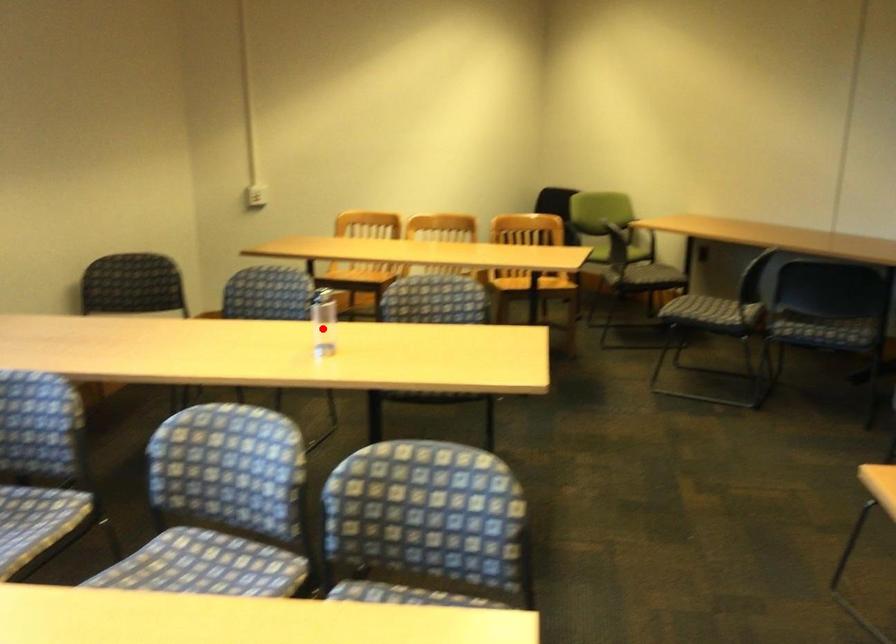
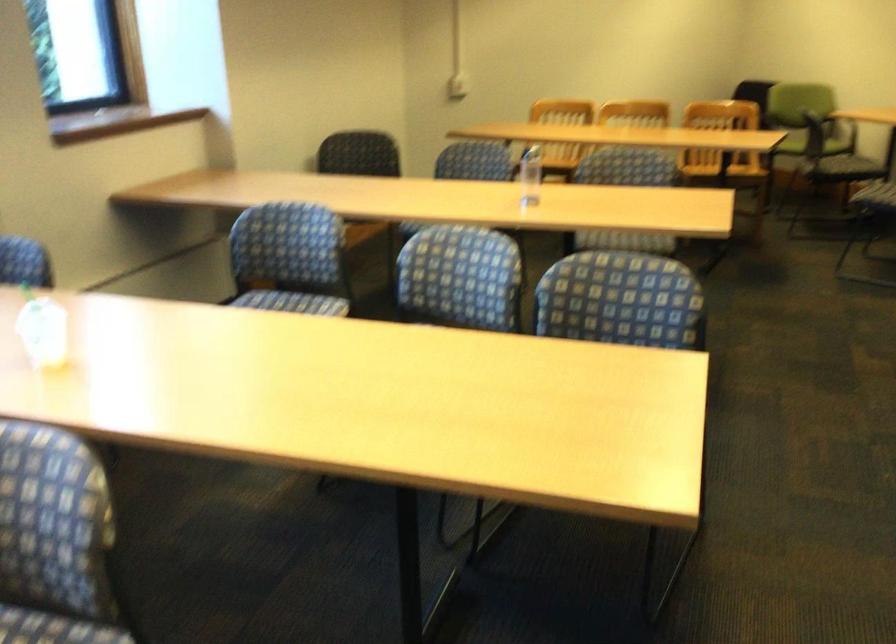
Locate, in the second image, the point that corresponds to the highlighted location in the first image.

(530, 176)